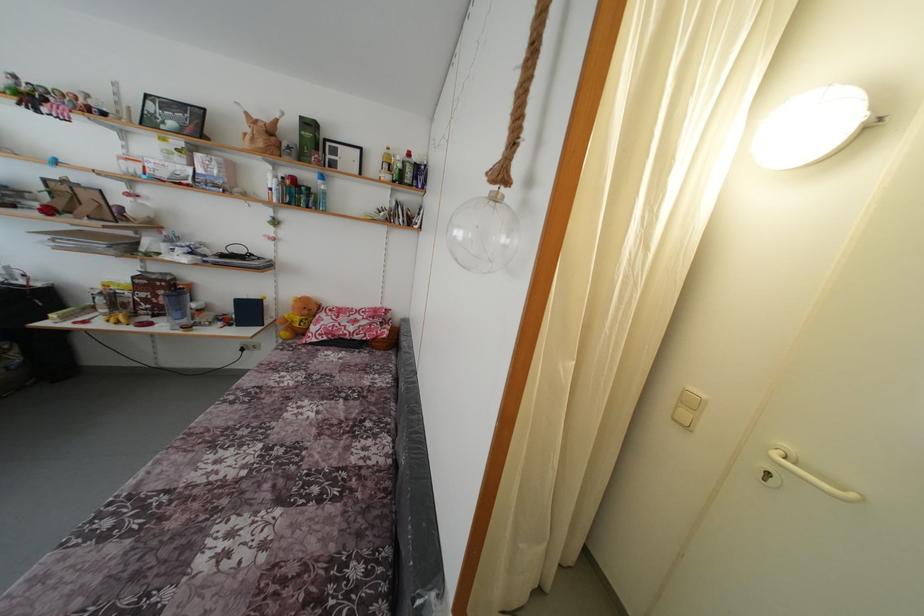
The location [297,317] corresponds to which object?

It corresponds to the yellow teddy bear in the image.